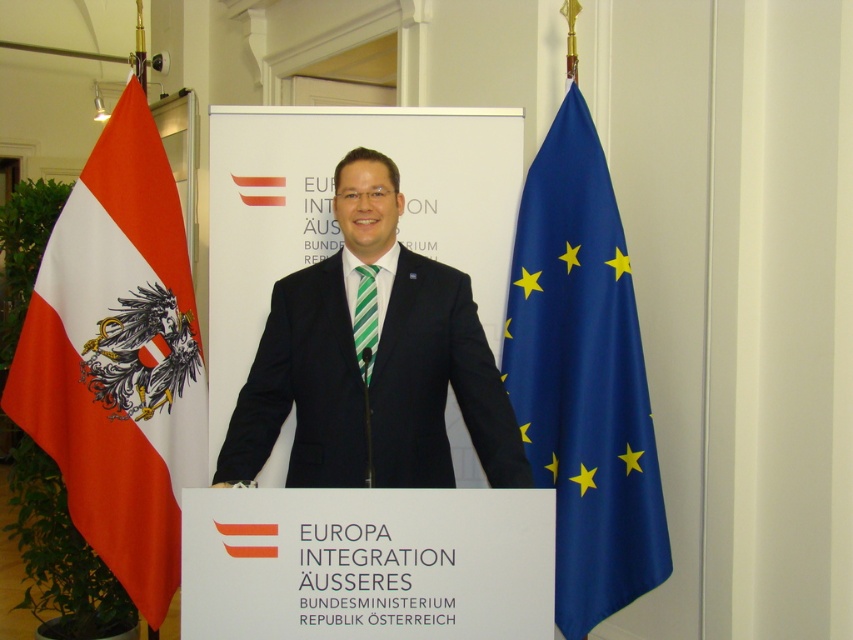
You are attending a diplomatic event and notice the blue satin flag at right and the green striped tie at center. Which object is taller?

The blue satin flag at right is taller than the green striped tie at center.